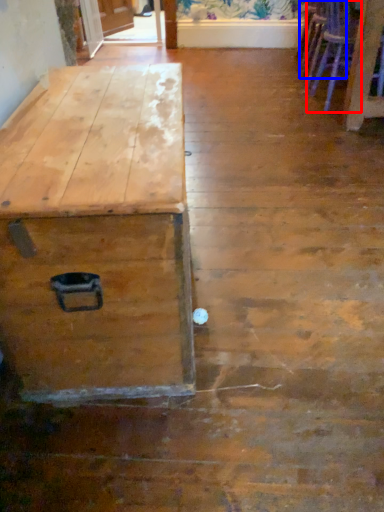
Question: Which of the following is the farthest to the observer, armchair (highlighted by a red box) or armchair (highlighted by a blue box)?

Choices:
 (A) armchair
 (B) armchair

Answer: (B)